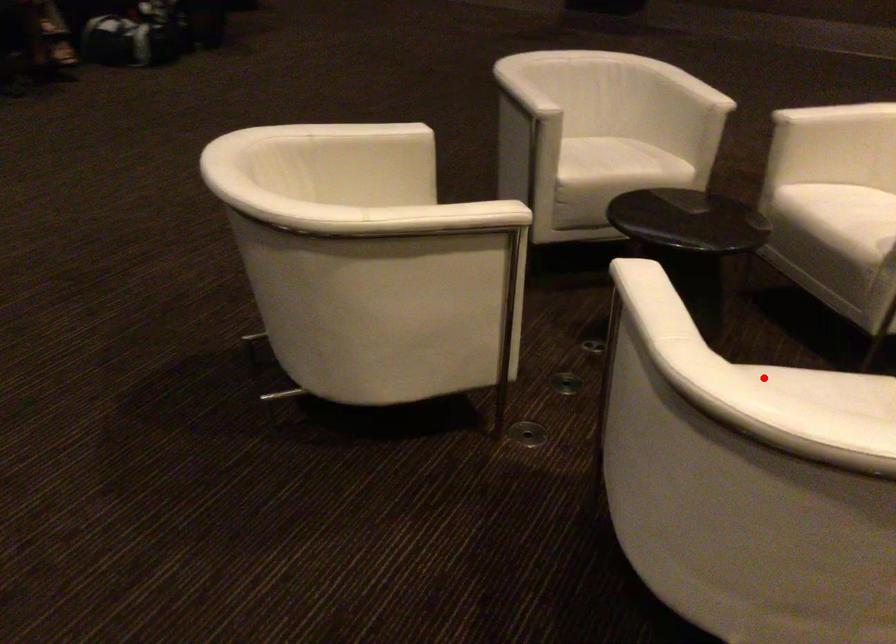
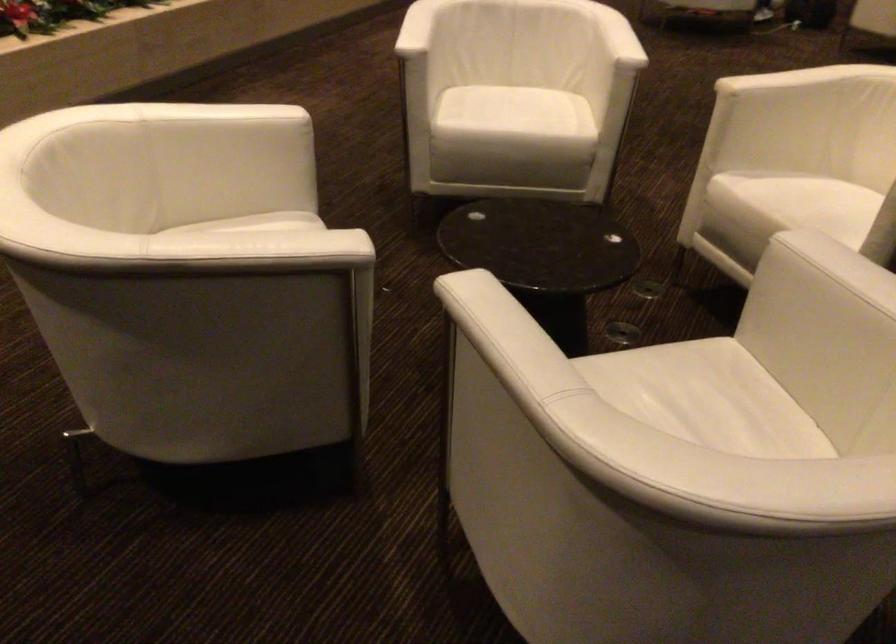
Where in the second image is the point corresponding to the highlighted location from the first image?

(524, 117)